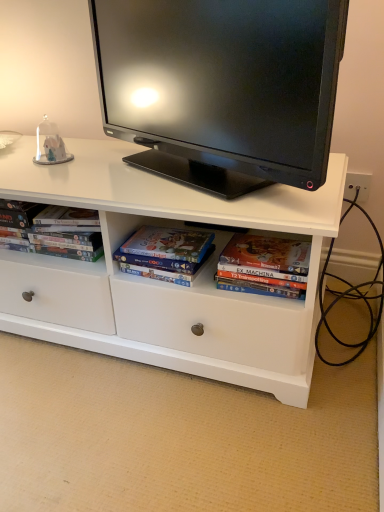
Question: Is the depth of matte black dvd case at left less than that of matte cardboard book at center?

Choices:
 (A) yes
 (B) no

Answer: (B)

Question: Could you tell me if matte black dvd case at left is turned towards matte cardboard book at center?

Choices:
 (A) yes
 (B) no

Answer: (B)

Question: Considering the relative sizes of matte black dvd case at left and matte cardboard book at center in the image provided, is matte black dvd case at left bigger than matte cardboard book at center?

Choices:
 (A) yes
 (B) no

Answer: (A)

Question: Is matte black dvd case at left looking in the opposite direction of matte cardboard book at center?

Choices:
 (A) no
 (B) yes

Answer: (A)

Question: From the image's perspective, does matte black dvd case at left appear lower than matte cardboard book at center?

Choices:
 (A) no
 (B) yes

Answer: (A)

Question: Is black glossy tv at upper center in front of or behind matte cardboard book at center in the image?

Choices:
 (A) front
 (B) behind

Answer: (A)

Question: Is black glossy tv at upper center wider or thinner than matte cardboard book at center?

Choices:
 (A) thin
 (B) wide

Answer: (B)

Question: In terms of height, does black glossy tv at upper center look taller or shorter compared to matte cardboard book at center?

Choices:
 (A) tall
 (B) short

Answer: (A)

Question: From the image's perspective, is black glossy tv at upper center located above or below matte cardboard book at center?

Choices:
 (A) above
 (B) below

Answer: (A)

Question: Relative to matte cardboard book at center, is matte black dvd case at left in front or behind?

Choices:
 (A) behind
 (B) front

Answer: (A)

Question: Is point (61, 248) positioned closer to the camera than point (127, 258)?

Choices:
 (A) farther
 (B) closer

Answer: (A)

Question: Based on their sizes in the image, would you say matte black dvd case at left is bigger or smaller than matte cardboard book at center?

Choices:
 (A) big
 (B) small

Answer: (A)

Question: Is matte black dvd case at left taller or shorter than matte cardboard book at center?

Choices:
 (A) short
 (B) tall

Answer: (B)

Question: Considering their positions, is black glossy tv at upper center located in front of or behind matte black dvd case at left?

Choices:
 (A) behind
 (B) front

Answer: (B)

Question: Is black glossy tv at upper center taller or shorter than matte black dvd case at left?

Choices:
 (A) tall
 (B) short

Answer: (A)